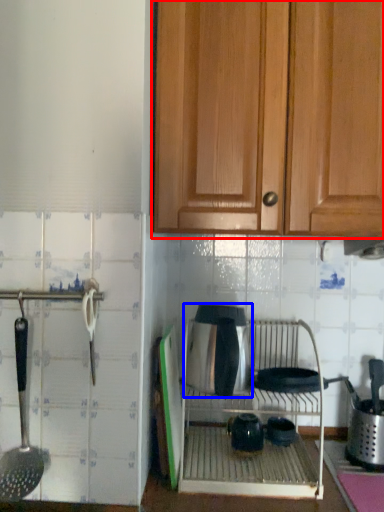
Question: Which object appears closest to the camera in this image, cabinetry (highlighted by a red box) or appliance (highlighted by a blue box)?

Choices:
 (A) cabinetry
 (B) appliance

Answer: (A)